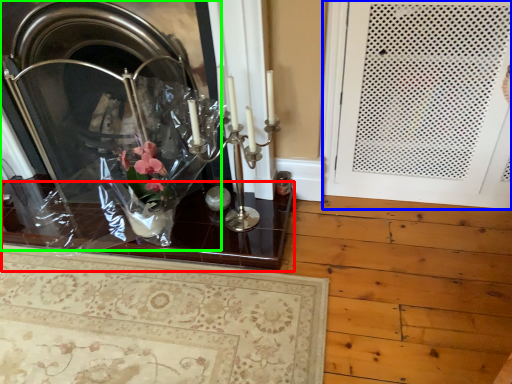
Question: Which is nearer to the table (highlighted by a red box)? door (highlighted by a blue box) or fireplace (highlighted by a green box).

Choices:
 (A) door
 (B) fireplace

Answer: (B)